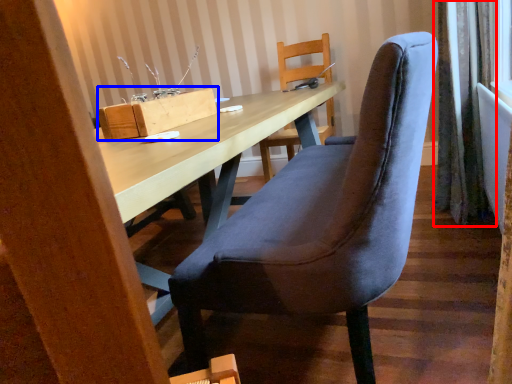
Question: Which object is closer to the camera taking this photo, curtain (highlighted by a red box) or cardboard box (highlighted by a blue box)?

Choices:
 (A) curtain
 (B) cardboard box

Answer: (B)